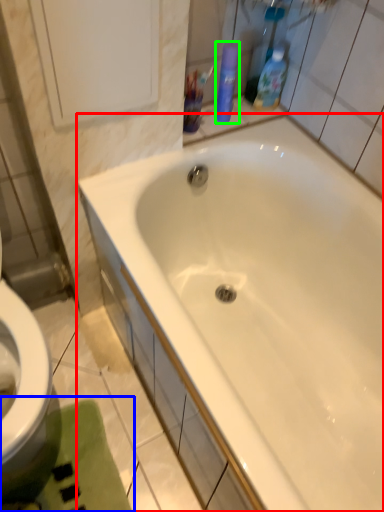
Question: Which object is the farthest from bathtub (highlighted by a red box)? Choose among these: bath mat (highlighted by a blue box) or cleaning product (highlighted by a green box).

Choices:
 (A) bath mat
 (B) cleaning product

Answer: (B)